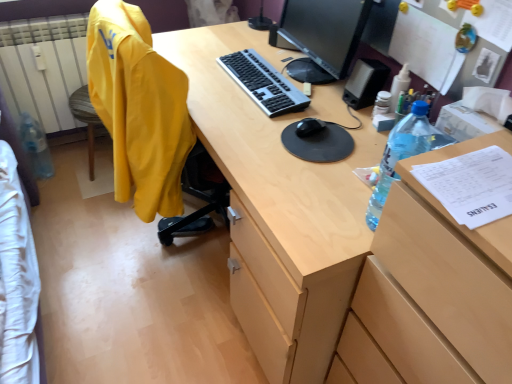
This screenshot has width=512, height=384. In order to click on vacant space positioned to the left of black glossy monitor at upper center in this screenshot , I will do `click(226, 66)`.